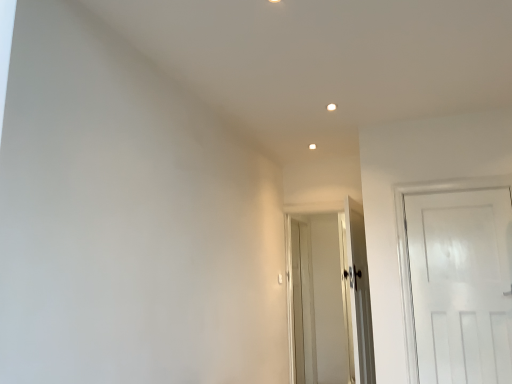
Question: Could you tell me if white matte door at right, the first door when ordered from front to back, is facing white glossy door at center, which is the second door from front to back?

Choices:
 (A) yes
 (B) no

Answer: (B)

Question: Can you confirm if white matte door at right, the first door when ordered from front to back, is thinner than white glossy door at center, the second door in the back-to-front sequence?

Choices:
 (A) no
 (B) yes

Answer: (B)

Question: Is white matte door at right, the first door when ordered from front to back, positioned behind white glossy door at center, the second door in the back-to-front sequence?

Choices:
 (A) yes
 (B) no

Answer: (B)

Question: Is white matte door at right, the first door when ordered from front to back, shorter than white glossy door at center, which is the second door from front to back?

Choices:
 (A) yes
 (B) no

Answer: (A)

Question: Considering the relative positions of white matte door at right, which is counted as the 3th door, starting from the back, and white glossy door at center, which is the second door from front to back, in the image provided, is white matte door at right, which is counted as the 3th door, starting from the back, to the right of white glossy door at center, which is the second door from front to back, from the viewer's perspective?

Choices:
 (A) no
 (B) yes

Answer: (B)

Question: From the image's perspective, is white wooden door at center, which appears as the 1th door when viewed from the back, located above or below white matte door at right, which is counted as the 3th door, starting from the back?

Choices:
 (A) below
 (B) above

Answer: (A)

Question: In terms of height, does white wooden door at center, which appears as the 1th door when viewed from the back, look taller or shorter compared to white matte door at right, which is counted as the 3th door, starting from the back?

Choices:
 (A) tall
 (B) short

Answer: (A)

Question: Considering their positions, is white wooden door at center, which appears as the 1th door when viewed from the back, located in front of or behind white matte door at right, the first door when ordered from front to back?

Choices:
 (A) behind
 (B) front

Answer: (A)

Question: Visually, is white wooden door at center, arranged as the third door when viewed from the front, positioned to the left or to the right of white matte door at right, the first door when ordered from front to back?

Choices:
 (A) left
 (B) right

Answer: (A)

Question: In terms of size, does white wooden door at center, which appears as the 1th door when viewed from the back, appear bigger or smaller than white glossy door at center, which is the second door from front to back?

Choices:
 (A) small
 (B) big

Answer: (B)

Question: Based on their positions, is white wooden door at center, which appears as the 1th door when viewed from the back, located to the left or right of white glossy door at center, the second door in the back-to-front sequence?

Choices:
 (A) right
 (B) left

Answer: (B)

Question: Is white wooden door at center, which appears as the 1th door when viewed from the back, situated inside white glossy door at center, the second door in the back-to-front sequence, or outside?

Choices:
 (A) inside
 (B) outside

Answer: (B)

Question: Is point (312, 218) positioned closer to the camera than point (348, 228)?

Choices:
 (A) farther
 (B) closer

Answer: (A)

Question: Is point (366, 264) positioned closer to the camera than point (290, 301)?

Choices:
 (A) closer
 (B) farther

Answer: (A)

Question: Would you say white glossy door at center, which is the second door from front to back, is to the left or to the right of white wooden door at center, arranged as the third door when viewed from the front, in the picture?

Choices:
 (A) left
 (B) right

Answer: (B)